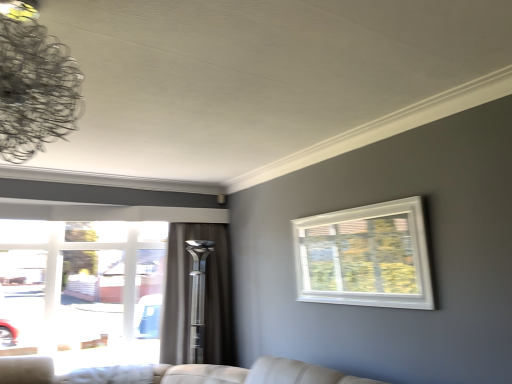
Question: Should I look upward or downward to see metallic wire chandelier at upper left?

Choices:
 (A) up
 (B) down

Answer: (A)

Question: Should I look upward or downward to see white plastic window at upper right, the 1th window viewed from the right?

Choices:
 (A) up
 (B) down

Answer: (B)

Question: Can you confirm if metallic wire chandelier at upper left is bigger than clear glass window at left, the first window when ordered from left to right?

Choices:
 (A) yes
 (B) no

Answer: (B)

Question: From a real-world perspective, is metallic wire chandelier at upper left over clear glass window at left, arranged as the 2th window when viewed from the right?

Choices:
 (A) no
 (B) yes

Answer: (B)

Question: Can you confirm if metallic wire chandelier at upper left is smaller than clear glass window at left, the first window when ordered from left to right?

Choices:
 (A) no
 (B) yes

Answer: (B)

Question: Considering the relative positions of metallic wire chandelier at upper left and clear glass window at left, which appears as the 1th window when viewed from the back, in the image provided, is metallic wire chandelier at upper left to the left of clear glass window at left, which appears as the 1th window when viewed from the back, from the viewer's perspective?

Choices:
 (A) no
 (B) yes

Answer: (A)

Question: Considering the relative positions of metallic wire chandelier at upper left and clear glass window at left, which appears as the 1th window when viewed from the back, in the image provided, is metallic wire chandelier at upper left to the right of clear glass window at left, which appears as the 1th window when viewed from the back, from the viewer's perspective?

Choices:
 (A) yes
 (B) no

Answer: (A)

Question: From a real-world perspective, does metallic wire chandelier at upper left sit lower than clear glass window at left, which appears as the 1th window when viewed from the back?

Choices:
 (A) yes
 (B) no

Answer: (B)

Question: Considering the relative sizes of silky gray curtain at center and white plastic window at upper right, the 1th window viewed from the right, in the image provided, is silky gray curtain at center smaller than white plastic window at upper right, the 1th window viewed from the right,?

Choices:
 (A) yes
 (B) no

Answer: (B)

Question: Could you tell me if silky gray curtain at center is facing white plastic window at upper right, which is counted as the first window, starting from the front?

Choices:
 (A) no
 (B) yes

Answer: (B)

Question: Considering the relative sizes of silky gray curtain at center and white plastic window at upper right, which is counted as the first window, starting from the front, in the image provided, is silky gray curtain at center bigger than white plastic window at upper right, which is counted as the first window, starting from the front,?

Choices:
 (A) yes
 (B) no

Answer: (A)

Question: Is there a large distance between silky gray curtain at center and white plastic window at upper right, which is the second window in back-to-front order?

Choices:
 (A) no
 (B) yes

Answer: (B)

Question: Is the depth of silky gray curtain at center less than that of white plastic window at upper right, which is counted as the first window, starting from the front?

Choices:
 (A) yes
 (B) no

Answer: (B)

Question: Does silky gray curtain at center have a greater height compared to white plastic window at upper right, positioned as the second window in left-to-right order?

Choices:
 (A) no
 (B) yes

Answer: (B)

Question: From a real-world perspective, is metallic wire chandelier at upper left on top of silky gray curtain at center?

Choices:
 (A) no
 (B) yes

Answer: (B)